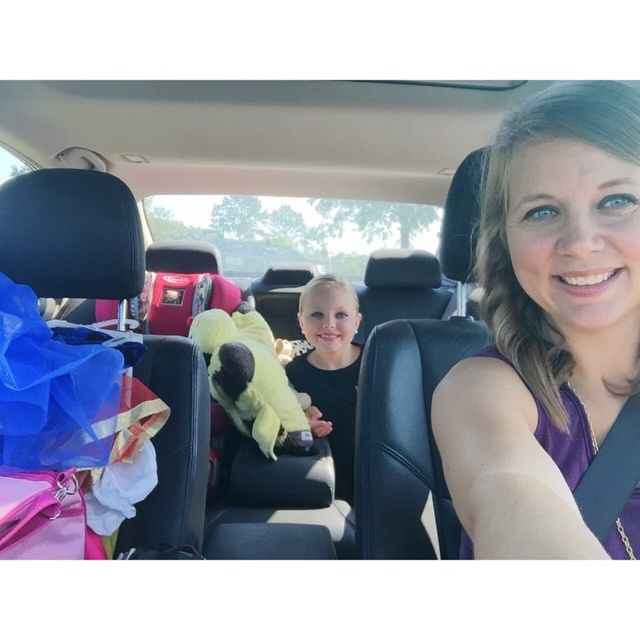
You are a fashion designer observing the clothing items in the car. Which clothing item has a slimmer silhouette between the purple fabric sleeveless top at center and the black matte dress at center?

The purple fabric sleeveless top at center has a slimmer silhouette than the black matte dress at center.

You are a photographer trying to capture a photo of the purple fabric sleeveless top at center and the soft yellow plush at center in the car. If your camera has a maximum focus range of 5 feet, will both objects be in focus?

The purple fabric sleeveless top at center and the soft yellow plush at center are 4.65 feet apart. Since the distance between them is within the camera maximum focus range of 5 feet, both objects will be in focus.